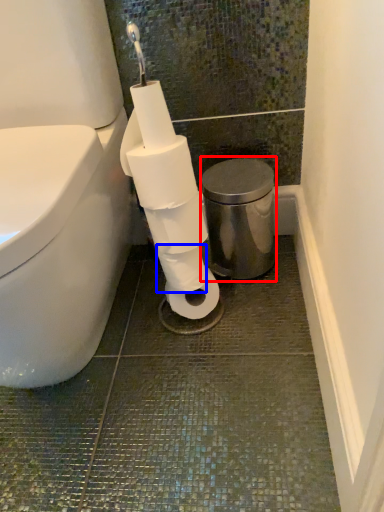
Question: Which object is closer to the camera taking this photo, bidet (highlighted by a red box) or toilet paper (highlighted by a blue box)?

Choices:
 (A) bidet
 (B) toilet paper

Answer: (B)